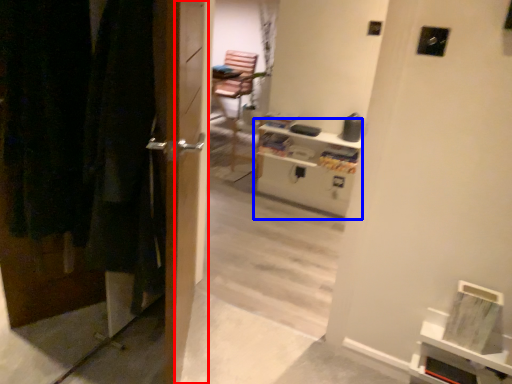
Question: Which object appears closest to the camera in this image, screen door (highlighted by a red box) or entertainment center (highlighted by a blue box)?

Choices:
 (A) screen door
 (B) entertainment center

Answer: (A)